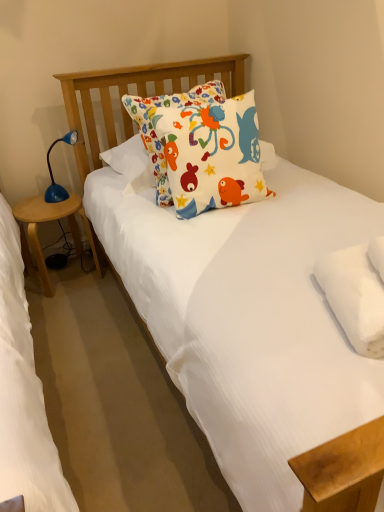
Question: Could you tell me if blue plastic table lamp at left is turned towards white fluffy pillow at upper right, the second pillow when ordered from back to front?

Choices:
 (A) no
 (B) yes

Answer: (A)

Question: From the image's perspective, is blue plastic table lamp at left under white fluffy pillow at upper right, acting as the first pillow starting from the right?

Choices:
 (A) no
 (B) yes

Answer: (A)

Question: Would you consider blue plastic table lamp at left to be distant from white fluffy pillow at upper right, the second pillow when ordered from back to front?

Choices:
 (A) yes
 (B) no

Answer: (A)

Question: Would you say blue plastic table lamp at left contains white fluffy pillow at upper right, the 2th pillow from the left?

Choices:
 (A) yes
 (B) no

Answer: (B)

Question: Is blue plastic table lamp at left taller than white fluffy pillow at upper right, the 1th pillow ordered from the bottom?

Choices:
 (A) no
 (B) yes

Answer: (B)

Question: Is blue plastic table lamp at left beside white fluffy pillow at upper right, acting as the second pillow starting from the top?

Choices:
 (A) yes
 (B) no

Answer: (B)

Question: Is wooden side table at left next to white fluffy pillow at upper right, the second pillow when ordered from back to front, and touching it?

Choices:
 (A) no
 (B) yes

Answer: (A)

Question: Does wooden side table at left have a larger size compared to white fluffy pillow at upper right, the 1th pillow ordered from the bottom?

Choices:
 (A) no
 (B) yes

Answer: (B)

Question: Is wooden side table at left not inside white fluffy pillow at upper right, acting as the second pillow starting from the top?

Choices:
 (A) yes
 (B) no

Answer: (A)

Question: Is wooden side table at left positioned far away from white fluffy pillow at upper right, acting as the second pillow starting from the top?

Choices:
 (A) no
 (B) yes

Answer: (B)

Question: Does wooden side table at left appear on the left side of white fluffy pillow at upper right, acting as the first pillow starting from the right?

Choices:
 (A) yes
 (B) no

Answer: (A)

Question: Can you confirm if wooden side table at left is wider than white fluffy pillow at upper right, the second pillow when ordered from back to front?

Choices:
 (A) yes
 (B) no

Answer: (A)

Question: Are blue plastic table lamp at left and wooden side table at left making contact?

Choices:
 (A) yes
 (B) no

Answer: (B)